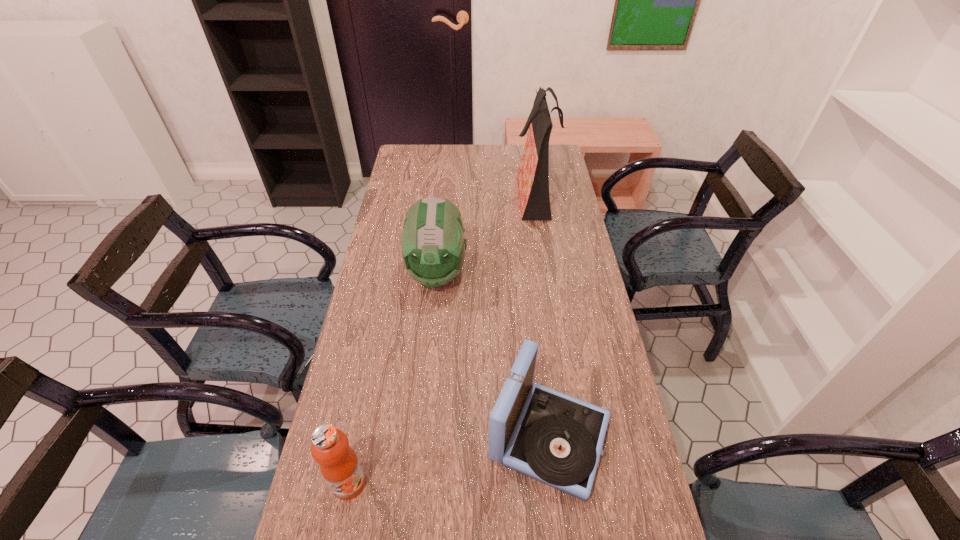
The image size is (960, 540). Identify the location of the farthest object. (533, 175).

Find the location of a particular element. The width and height of the screenshot is (960, 540). the tallest object is located at coordinates (533, 175).

At what (x,y) coordinates should I click in order to perform the action: click on football helmet. Please return your answer as a coordinate pair (x, y). The width and height of the screenshot is (960, 540). Looking at the image, I should click on point(433,246).

Find the location of a particular element. the third object from right to left is located at coordinates 433,246.

The height and width of the screenshot is (540, 960). Find the location of `fruit juice`. fruit juice is located at coordinates (339, 465).

Identify the location of phonograph record. (556, 439).

Identify the location of free space located 0.070m on the front side of the shopping bag. This screenshot has height=540, width=960. (497, 194).

You are a GUI agent. You are given a task and a screenshot of the screen. Output one action in this format:
    pyautogui.click(x=<x>, y=<y>)
    Task: Click on the vacant space located on the front side of the shopping bag
    
    Given the screenshot: What is the action you would take?
    pyautogui.click(x=424, y=194)

Find the location of a particular element. This screenshot has width=960, height=540. vacant area situated 0.210m on the front side of the shopping bag is located at coordinates (465, 194).

This screenshot has height=540, width=960. What are the coordinates of `vacant region located 0.320m on the visor of the football helmet` in the screenshot? It's located at (425, 388).